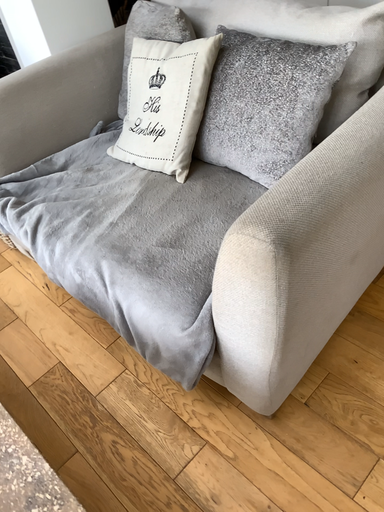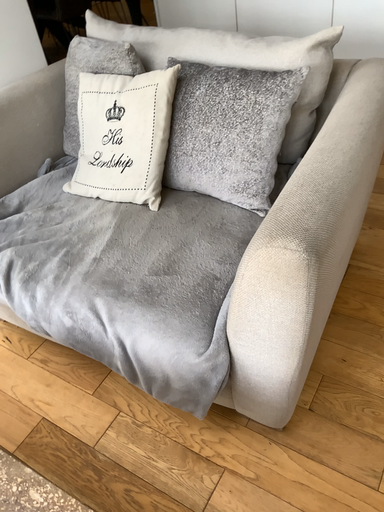
Question: Which way did the camera rotate in the video?

Choices:
 (A) rotated left
 (B) rotated right

Answer: (B)